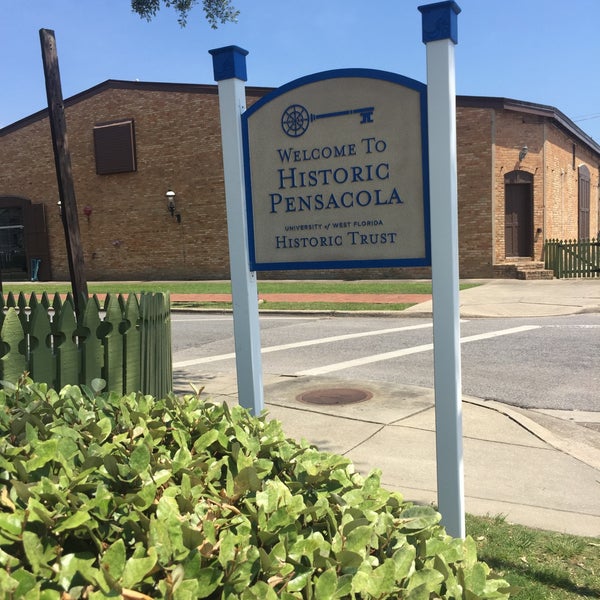
Locate an element on the screen. door is located at coordinates (527, 221).